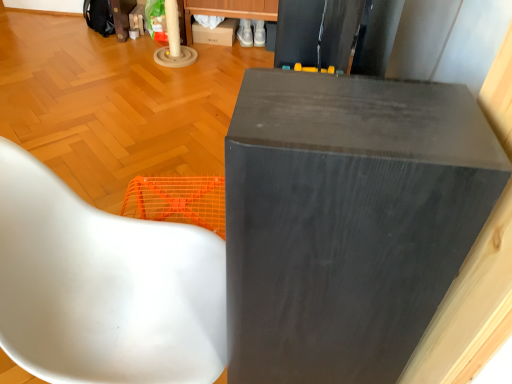
This screenshot has width=512, height=384. I want to click on free space above matte black speaker at upper center (from a real-world perspective), so click(362, 111).